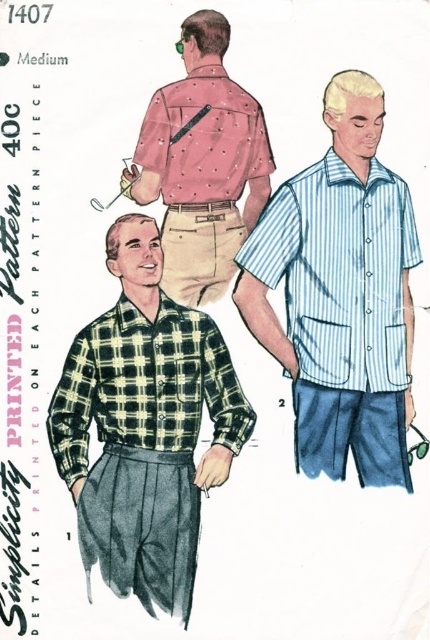
You are designing a layout for a new advertisement and need to place two shirts side by side. The pink dotted shirt at upper center and the green checkered shirt at center must be positioned such that there is exactly 8 inches between them. Given the current spacing of 9.09 inches between them in the original image, what adjustment should you make to meet the required distance?

The current distance between the pink dotted shirt at upper center and the green checkered shirt at center is 9.09 inches. To reduce the distance to exactly 8 inches, you should move them closer together by approximately 1.09 inches.